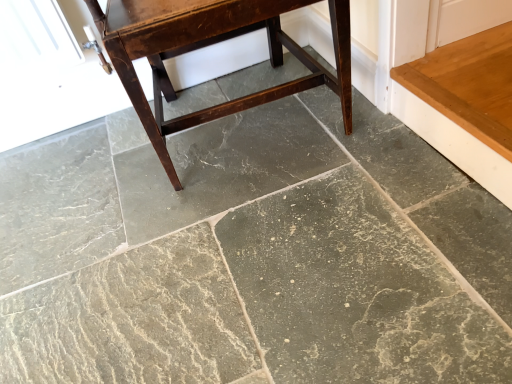
The height and width of the screenshot is (384, 512). I want to click on dark brown wood table at center, so click(x=208, y=45).

The width and height of the screenshot is (512, 384). What do you see at coordinates (208, 45) in the screenshot?
I see `dark brown wood table at center` at bounding box center [208, 45].

Where is `dark brown wood table at center`? The image size is (512, 384). dark brown wood table at center is located at coordinates (208, 45).